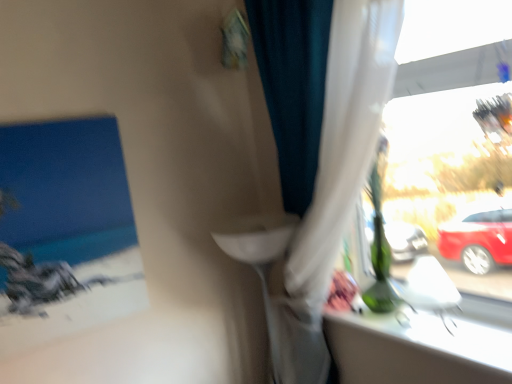
Measure the distance between point [289,342] and camera.

The distance of point [289,342] from camera is 1.42 meters.

Describe the element at coordinates (320, 142) in the screenshot. The width and height of the screenshot is (512, 384). I see `white sheer curtain at right` at that location.

What is the approximate height of white sheer curtain at right?

It is 4.70 feet.

What are the coordinates of `white sheer curtain at right` in the screenshot? It's located at (320, 142).

The width and height of the screenshot is (512, 384). What do you see at coordinates (422, 346) in the screenshot? I see `white glossy window sill at upper right` at bounding box center [422, 346].

Identify the location of white glossy window sill at upper right. The height and width of the screenshot is (384, 512). (422, 346).

Find the location of a particular element. Image resolution: width=512 pixels, height=384 pixels. white sheer curtain at right is located at coordinates [320, 142].

Between white sheer curtain at right and white glossy window sill at upper right, which one appears on the right side from the viewer's perspective?

Positioned to the right is white glossy window sill at upper right.

Which object is more forward, white sheer curtain at right or white glossy window sill at upper right?

white sheer curtain at right is in front.

Between point (392, 33) and point (401, 326), which one is positioned in front?

Positioned in front is point (392, 33).

From the image's perspective, is white sheer curtain at right above or below white glossy window sill at upper right?

white sheer curtain at right is situated higher than white glossy window sill at upper right in the image.

From a real-world perspective, does white sheer curtain at right sit lower than white glossy window sill at upper right?

No, from a real-world perspective, white sheer curtain at right is not below white glossy window sill at upper right.

Considering the sizes of objects white sheer curtain at right and white glossy window sill at upper right in the image provided, who is wider, white sheer curtain at right or white glossy window sill at upper right?

Wider between the two is white glossy window sill at upper right.

Considering the sizes of objects white sheer curtain at right and white glossy window sill at upper right in the image provided, who is shorter, white sheer curtain at right or white glossy window sill at upper right?

With less height is white glossy window sill at upper right.

Who is bigger, white sheer curtain at right or white glossy window sill at upper right?

Bigger between the two is white sheer curtain at right.

Is white sheer curtain at right surrounding white glossy window sill at upper right?

No, white glossy window sill at upper right is not surrounded by white sheer curtain at right.

Is white sheer curtain at right touching white glossy window sill at upper right?

No, white sheer curtain at right is not with white glossy window sill at upper right.

Is white sheer curtain at right positioned with its back to white glossy window sill at upper right?

Absolutely, white sheer curtain at right is directed away from white glossy window sill at upper right.

Locate an element on the screen. The height and width of the screenshot is (384, 512). curtain above the white glossy window sill at upper right (from a real-world perspective) is located at coordinates (320, 142).

In the image, is white glossy window sill at upper right on the left side or the right side of white sheer curtain at right?

white glossy window sill at upper right is positioned on white sheer curtain at right's right side.

Which is behind, white glossy window sill at upper right or white sheer curtain at right?

white glossy window sill at upper right.

Is point (354, 363) behind point (318, 188)?

Yes, point (354, 363) is behind point (318, 188).

From the image's perspective, is white glossy window sill at upper right on top of white sheer curtain at right?

No.

From a real-world perspective, is white glossy window sill at upper right positioned over white sheer curtain at right based on gravity?

No, from a real-world perspective, white glossy window sill at upper right is not over white sheer curtain at right

Which of these two, white glossy window sill at upper right or white sheer curtain at right, is thinner?

With smaller width is white sheer curtain at right.

Is white glossy window sill at upper right shorter than white sheer curtain at right?

Correct, white glossy window sill at upper right is not as tall as white sheer curtain at right.

Is white glossy window sill at upper right smaller than white sheer curtain at right?

Yes.

Would you say white glossy window sill at upper right is outside white sheer curtain at right?

Indeed, white glossy window sill at upper right is completely outside white sheer curtain at right.

Are white glossy window sill at upper right and white sheer curtain at right far apart?

No.

Is white glossy window sill at upper right oriented towards white sheer curtain at right?

Yes, white glossy window sill at upper right is facing white sheer curtain at right.

What's the angular difference between white glossy window sill at upper right and white sheer curtain at right's facing directions?

The angle between the facing direction of white glossy window sill at upper right and the facing direction of white sheer curtain at right is 1.37 degrees.

I want to click on curtain lying on the left of white glossy window sill at upper right, so coord(320,142).

Identify the location of curtain on the left of the white glossy window sill at upper right. (320, 142).

At what (x,y) coordinates should I click in order to perform the action: click on window sill below the white sheer curtain at right (from the image's perspective). Please return your answer as a coordinate pair (x, y). The height and width of the screenshot is (384, 512). Looking at the image, I should click on (422, 346).